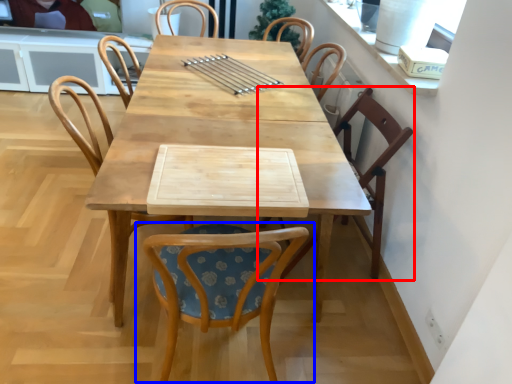
Question: Among these objects, which one is nearest to the camera, chair (highlighted by a red box) or chair (highlighted by a blue box)?

Choices:
 (A) chair
 (B) chair

Answer: (B)